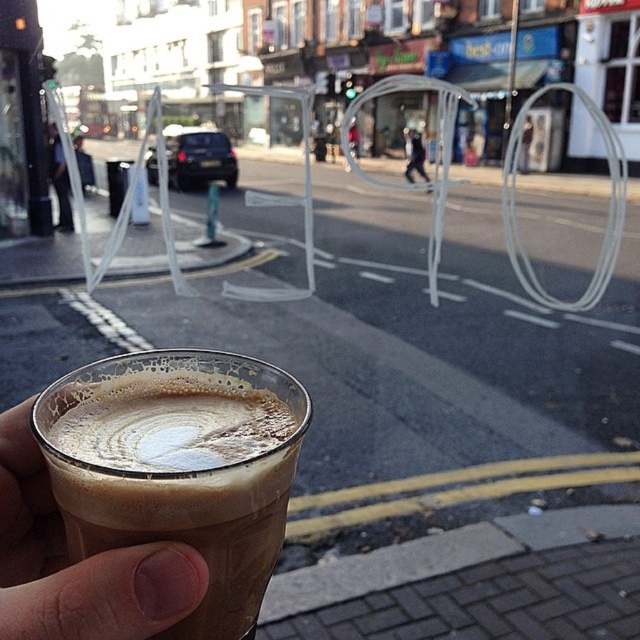
This screenshot has height=640, width=640. I want to click on translucent glass cup at lower left, so click(x=77, y=563).

Is translucent glass cup at lower left in front of dark blue jeans at left?

Yes.

Who is more forward, (104, 577) or (65, 205)?

Point (104, 577) is more forward.

This screenshot has height=640, width=640. What are the coordinates of `translucent glass cup at lower left` in the screenshot? It's located at (77, 563).

Does translucent glass cup at lower left have a smaller size compared to dark blue jeans at center?

No, translucent glass cup at lower left is not smaller than dark blue jeans at center.

Is point (166, 579) farther from camera compared to point (426, 176)?

No.

The image size is (640, 640). Find the location of `translucent glass cup at lower left`. translucent glass cup at lower left is located at coordinates (77, 563).

Does foamy brown latte at lower left have a lesser width compared to dark blue jeans at center?

No.

Does foamy brown latte at lower left have a greater width compared to dark blue jeans at center?

Correct, the width of foamy brown latte at lower left exceeds that of dark blue jeans at center.

Who is more forward, (150, 467) or (417, 163)?

Positioned in front is point (150, 467).

At what (x,y) coordinates should I click in order to perform the action: click on foamy brown latte at lower left. Please return your answer as a coordinate pair (x, y). The width and height of the screenshot is (640, 640). Looking at the image, I should click on (179, 467).